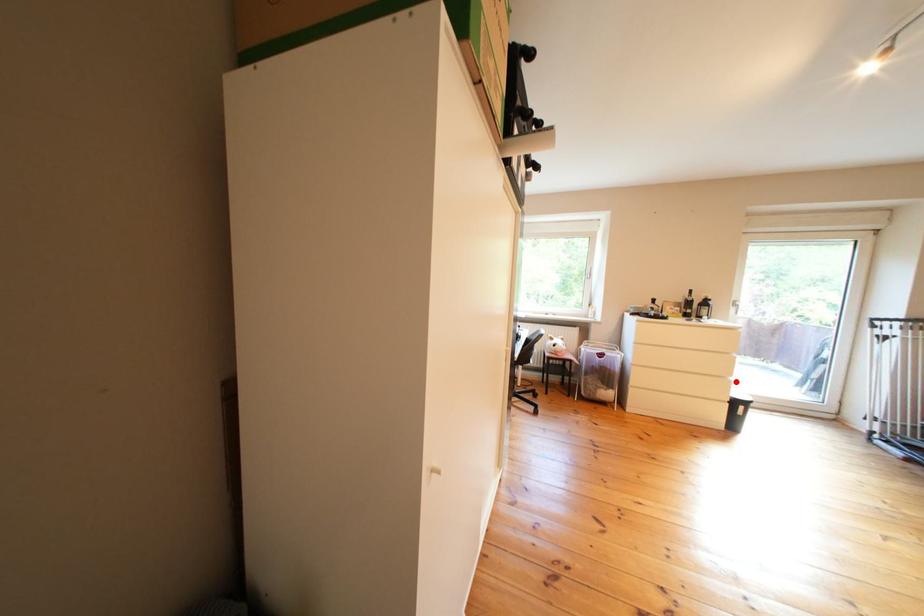
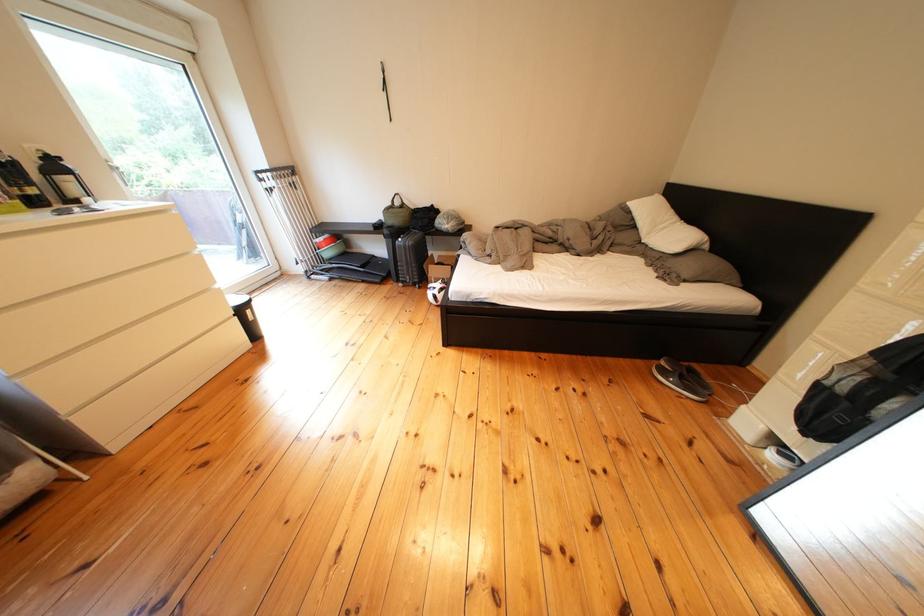
Question: A red point is marked in image1. In image2, is the corresponding 3D point closer to the camera or farther? Reply with the corresponding letter.

Choices:
 (A) The corresponding 3D point is closer.
 (B) The corresponding 3D point is farther.

Answer: (A)